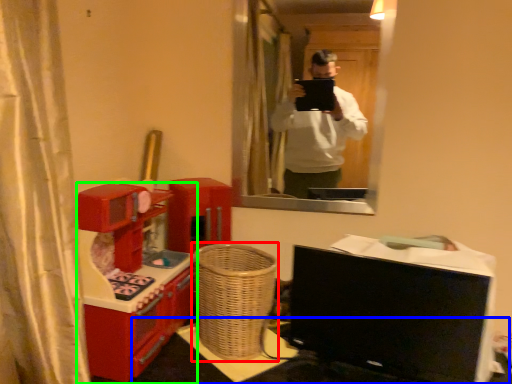
Question: Estimate the real-world distances between objects in this image. Which object is farther from basket (highlighted by a red box), table (highlighted by a blue box) or furniture (highlighted by a green box)?

Choices:
 (A) table
 (B) furniture

Answer: (B)